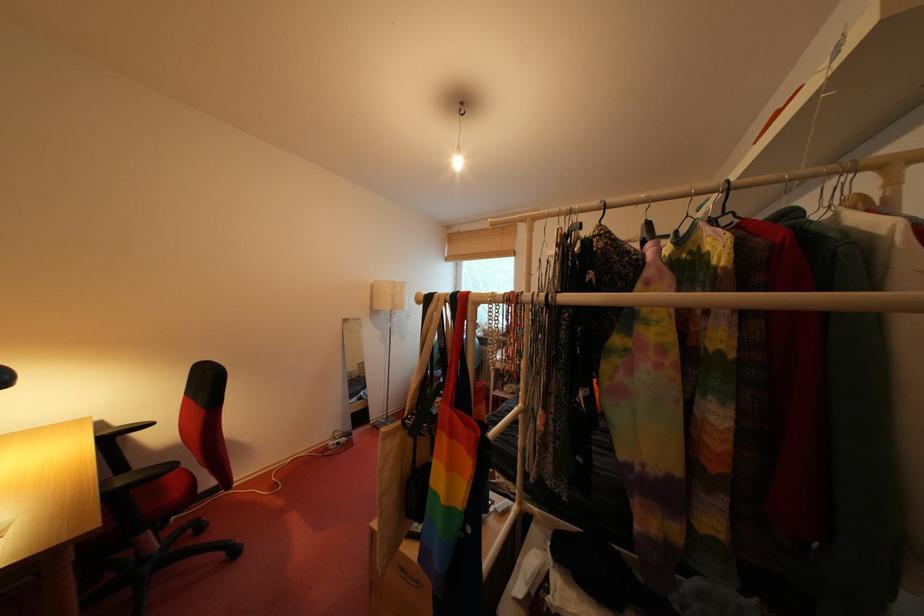
At what (x,y) coordinates should I click in order to perform the action: click on black chair armrest. Please return your answer as a coordinate pair (x, y). This screenshot has width=924, height=616. Looking at the image, I should click on (130, 428).